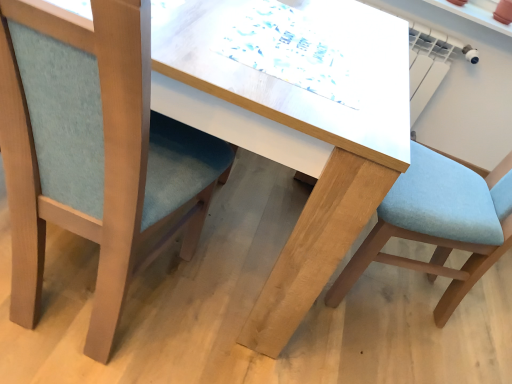
Find the location of `light blue fabric chair at left, acting as the first chair starting from the left`. light blue fabric chair at left, acting as the first chair starting from the left is located at coordinates (93, 150).

What is the approximate width of light blue fabric chair at left, acting as the first chair starting from the left?

19.78 inches.

In order to face light blue fabric chair at left, placed as the 2th chair when sorted from right to left, should I rotate leftwards or rightwards?

You should rotate left by 18.095 degrees.

What do you see at coordinates (93, 150) in the screenshot?
I see `light blue fabric chair at left, placed as the 2th chair when sorted from right to left` at bounding box center [93, 150].

Where is `light blue fabric chair at right, arranged as the 1th chair when viewed from the right`? The width and height of the screenshot is (512, 384). light blue fabric chair at right, arranged as the 1th chair when viewed from the right is located at coordinates (436, 226).

Describe the element at coordinates (436, 226) in the screenshot. I see `light blue fabric chair at right, arranged as the 1th chair when viewed from the right` at that location.

You are a GUI agent. You are given a task and a screenshot of the screen. Output one action in this format:
    pyautogui.click(x=<x>, y=<y>)
    Task: Click on the light blue fabric chair at left, acting as the first chair starting from the left
    
    Given the screenshot: What is the action you would take?
    pyautogui.click(x=93, y=150)

Considering the positions of objects light blue fabric chair at right, arranged as the 1th chair when viewed from the right, and light blue fabric chair at left, acting as the first chair starting from the left, in the image provided, who is more to the left, light blue fabric chair at right, arranged as the 1th chair when viewed from the right, or light blue fabric chair at left, acting as the first chair starting from the left,?

light blue fabric chair at left, acting as the first chair starting from the left, is more to the left.

Between light blue fabric chair at right, which is the second chair from left to right, and light blue fabric chair at left, acting as the first chair starting from the left, which one is positioned in front?

Positioned in front is light blue fabric chair at left, acting as the first chair starting from the left.

Does point (511, 157) lie behind point (51, 186)?

Yes, it is behind point (51, 186).

From the image's perspective, is light blue fabric chair at right, arranged as the 1th chair when viewed from the right, located above light blue fabric chair at left, placed as the 2th chair when sorted from right to left?

No, from the image's perspective, light blue fabric chair at right, arranged as the 1th chair when viewed from the right, is not on top of light blue fabric chair at left, placed as the 2th chair when sorted from right to left.

From a real-world perspective, does light blue fabric chair at right, which is the second chair from left to right, stand above light blue fabric chair at left, acting as the first chair starting from the left?

Yes, from a real-world perspective, light blue fabric chair at right, which is the second chair from left to right, is over light blue fabric chair at left, acting as the first chair starting from the left

Between light blue fabric chair at right, which is the second chair from left to right, and light blue fabric chair at left, placed as the 2th chair when sorted from right to left, which one has larger width?

light blue fabric chair at right, which is the second chair from left to right.

Considering the sizes of objects light blue fabric chair at right, arranged as the 1th chair when viewed from the right, and light blue fabric chair at left, placed as the 2th chair when sorted from right to left, in the image provided, who is shorter, light blue fabric chair at right, arranged as the 1th chair when viewed from the right, or light blue fabric chair at left, placed as the 2th chair when sorted from right to left,?

Standing shorter between the two is light blue fabric chair at left, placed as the 2th chair when sorted from right to left.

Consider the image. Is light blue fabric chair at right, which is the second chair from left to right, smaller than light blue fabric chair at left, acting as the first chair starting from the left?

Actually, light blue fabric chair at right, which is the second chair from left to right, might be larger than light blue fabric chair at left, acting as the first chair starting from the left.

Is light blue fabric chair at right, which is the second chair from left to right, not inside light blue fabric chair at left, placed as the 2th chair when sorted from right to left?

Indeed, light blue fabric chair at right, which is the second chair from left to right, is completely outside light blue fabric chair at left, placed as the 2th chair when sorted from right to left.

Is light blue fabric chair at right, arranged as the 1th chair when viewed from the right, next to light blue fabric chair at left, acting as the first chair starting from the left?

No, light blue fabric chair at right, arranged as the 1th chair when viewed from the right, is not touching light blue fabric chair at left, acting as the first chair starting from the left.

Does light blue fabric chair at right, arranged as the 1th chair when viewed from the right, turn towards light blue fabric chair at left, acting as the first chair starting from the left?

No, light blue fabric chair at right, arranged as the 1th chair when viewed from the right, is not turned towards light blue fabric chair at left, acting as the first chair starting from the left.

What's the angular difference between light blue fabric chair at right, arranged as the 1th chair when viewed from the right, and light blue fabric chair at left, placed as the 2th chair when sorted from right to left,'s facing directions?

There is a 90-degree angle between the facing directions of light blue fabric chair at right, arranged as the 1th chair when viewed from the right, and light blue fabric chair at left, placed as the 2th chair when sorted from right to left.

Locate an element on the screen. chair lying on the right of light blue fabric chair at left, placed as the 2th chair when sorted from right to left is located at coordinates (436, 226).

Does light blue fabric chair at left, placed as the 2th chair when sorted from right to left, appear on the left side of light blue fabric chair at right, arranged as the 1th chair when viewed from the right?

Indeed, light blue fabric chair at left, placed as the 2th chair when sorted from right to left, is positioned on the left side of light blue fabric chair at right, arranged as the 1th chair when viewed from the right.

Which object is further away from the camera, light blue fabric chair at left, acting as the first chair starting from the left, or light blue fabric chair at right, arranged as the 1th chair when viewed from the right?

light blue fabric chair at right, arranged as the 1th chair when viewed from the right, is further away from the camera.

Is point (20, 298) more distant than point (439, 185)?

No, it is in front of (439, 185).

From the image's perspective, between light blue fabric chair at left, placed as the 2th chair when sorted from right to left, and light blue fabric chair at right, arranged as the 1th chair when viewed from the right, who is located below?

light blue fabric chair at right, arranged as the 1th chair when viewed from the right, from the image's perspective.

From a real-world perspective, is light blue fabric chair at left, acting as the first chair starting from the left, physically located above or below light blue fabric chair at right, arranged as the 1th chair when viewed from the right?

light blue fabric chair at left, acting as the first chair starting from the left, is situated lower than light blue fabric chair at right, arranged as the 1th chair when viewed from the right, in the real world.

Does light blue fabric chair at left, acting as the first chair starting from the left, have a greater width compared to light blue fabric chair at right, arranged as the 1th chair when viewed from the right?

No, light blue fabric chair at left, acting as the first chair starting from the left, is not wider than light blue fabric chair at right, arranged as the 1th chair when viewed from the right.

Between light blue fabric chair at left, placed as the 2th chair when sorted from right to left, and light blue fabric chair at right, which is the second chair from left to right, which one has more height?

With more height is light blue fabric chair at right, which is the second chair from left to right.

Can you confirm if light blue fabric chair at left, placed as the 2th chair when sorted from right to left, is smaller than light blue fabric chair at right, arranged as the 1th chair when viewed from the right?

Correct, light blue fabric chair at left, placed as the 2th chair when sorted from right to left, occupies less space than light blue fabric chair at right, arranged as the 1th chair when viewed from the right.

Is light blue fabric chair at left, placed as the 2th chair when sorted from right to left, positioned beyond the bounds of light blue fabric chair at right, which is the second chair from left to right?

That's correct, light blue fabric chair at left, placed as the 2th chair when sorted from right to left, is outside of light blue fabric chair at right, which is the second chair from left to right.

Is light blue fabric chair at left, placed as the 2th chair when sorted from right to left, touching light blue fabric chair at right, arranged as the 1th chair when viewed from the right?

light blue fabric chair at left, placed as the 2th chair when sorted from right to left, is not next to light blue fabric chair at right, arranged as the 1th chair when viewed from the right, and they're not touching.

Is light blue fabric chair at left, placed as the 2th chair when sorted from right to left, facing towards light blue fabric chair at right, arranged as the 1th chair when viewed from the right?

No.

Find the location of a particular element. chair on the right of light blue fabric chair at left, placed as the 2th chair when sorted from right to left is located at coordinates (436, 226).

Locate an element on the screen. The height and width of the screenshot is (384, 512). chair located above the light blue fabric chair at left, acting as the first chair starting from the left (from a real-world perspective) is located at coordinates (436, 226).

The height and width of the screenshot is (384, 512). In order to click on chair in front of the light blue fabric chair at right, which is the second chair from left to right in this screenshot , I will do `click(93, 150)`.